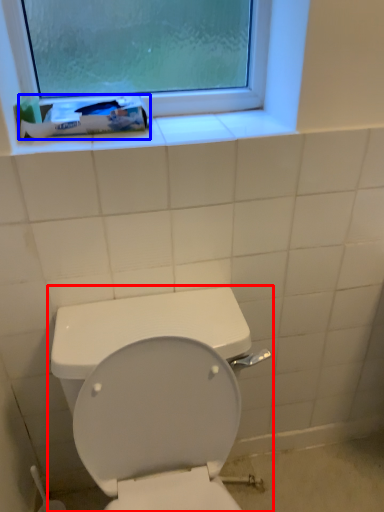
Question: Which point is further to the camera, toilet (highlighted by a red box) or toothpaste (highlighted by a blue box)?

Choices:
 (A) toilet
 (B) toothpaste

Answer: (B)